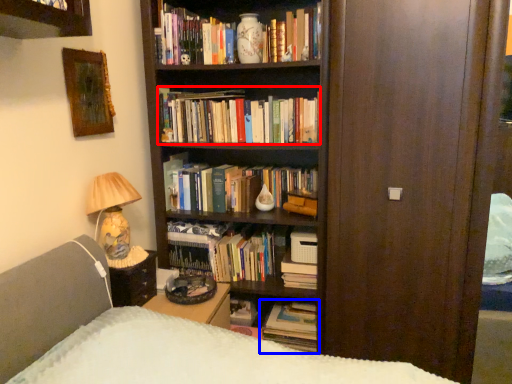
Question: Which of the following is the farthest to the observer, book (highlighted by a red box) or book (highlighted by a blue box)?

Choices:
 (A) book
 (B) book

Answer: (B)